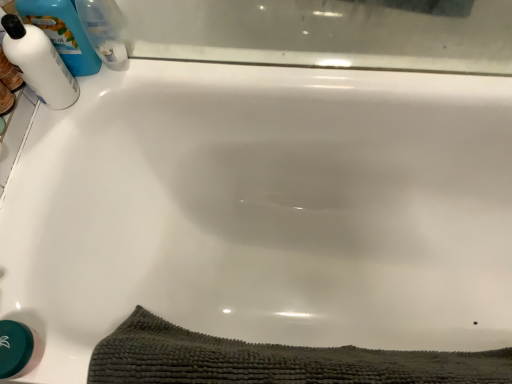
Question: In terms of width, does white glossy bottle at upper left, the 2th cleaning product in the left-to-right sequence, look wider or thinner when compared to blue plastic bottle at upper left, which is counted as the first cleaning product, starting from the right?

Choices:
 (A) thin
 (B) wide

Answer: (B)

Question: From their relative heights in the image, would you say white glossy bottle at upper left, the 2th cleaning product in the left-to-right sequence, is taller or shorter than blue plastic bottle at upper left, which is counted as the first cleaning product, starting from the right?

Choices:
 (A) short
 (B) tall

Answer: (B)

Question: Which object is positioned closest to the white glossy bottle at upper left, which is the 3th cleaning product in right-to-left order?

Choices:
 (A) blue plastic bottle at upper left, arranged as the third cleaning product when viewed from the left
 (B) dark gray textured bath towel at lower center
 (C) white glossy bottle at upper left, the 2th cleaning product viewed from the right

Answer: (C)

Question: Which is nearer to the dark gray textured bath towel at lower center?

Choices:
 (A) white glossy bottle at upper left, the 2th cleaning product viewed from the right
 (B) white glossy bottle at upper left, which is the 3th cleaning product in right-to-left order
 (C) blue plastic bottle at upper left, arranged as the third cleaning product when viewed from the left

Answer: (B)